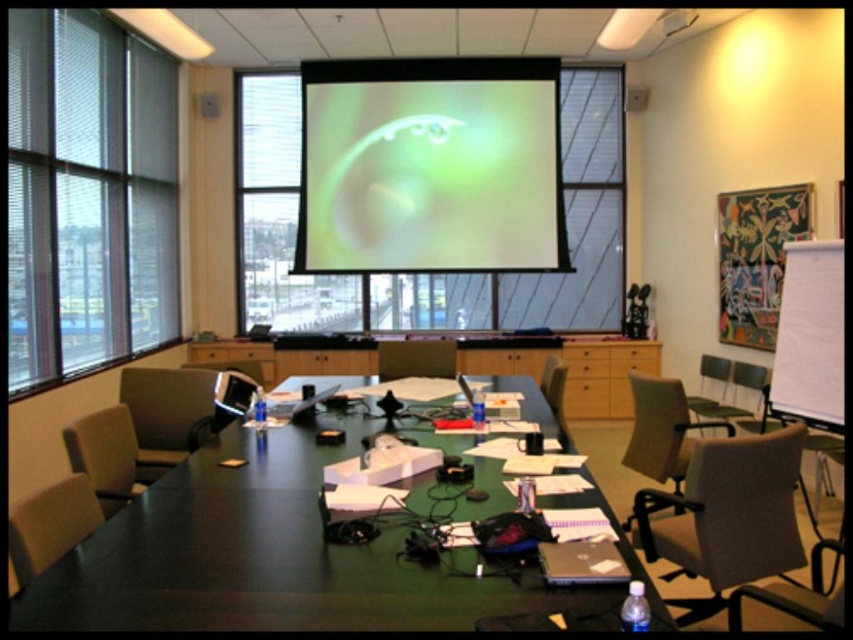
Question: Which object appears farthest from the camera in this image?

Choices:
 (A) matte gray chair at left
 (B) matte black projector at upper center

Answer: (B)

Question: Which point is closer to the camera taking this photo?

Choices:
 (A) [x=561, y=378]
 (B) [x=668, y=449]
 (C) [x=82, y=33]

Answer: (B)

Question: Is beige fabric chair at right to the right of matte beige chair at lower left from the viewer's perspective?

Choices:
 (A) no
 (B) yes

Answer: (B)

Question: Is matte gray chair at left above matte black chair at center?

Choices:
 (A) no
 (B) yes

Answer: (A)

Question: Which point is closer to the camera?

Choices:
 (A) (44, 564)
 (B) (132, 74)
 (C) (747, 396)

Answer: (A)

Question: Observing the image, what is the correct spatial positioning of matte gray chair at left in reference to wooden chair at center?

Choices:
 (A) below
 (B) above

Answer: (A)